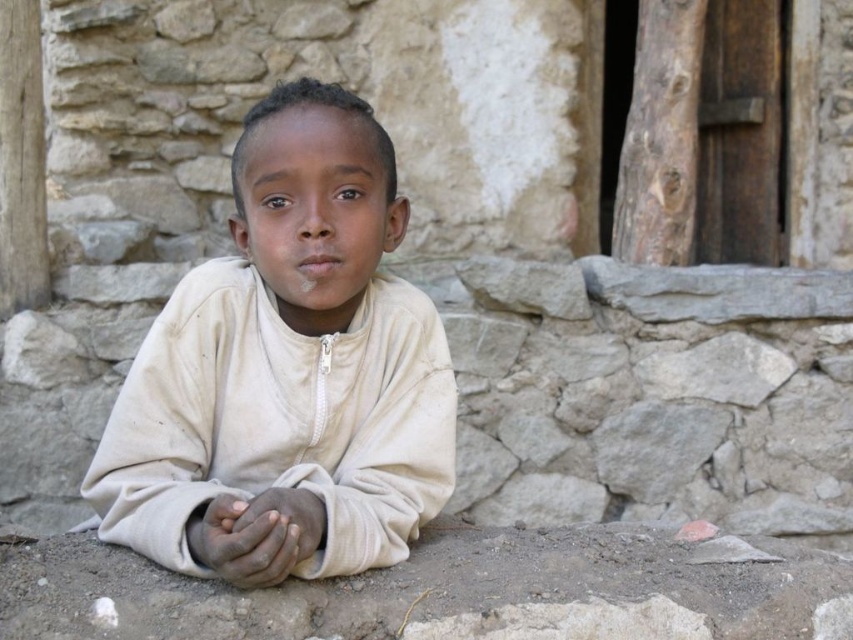
Can you confirm if white matte shirt at center is smaller than dark brown skin at center?

No, white matte shirt at center is not smaller than dark brown skin at center.

The width and height of the screenshot is (853, 640). In order to click on white matte shirt at center in this screenshot , I will do `click(287, 365)`.

Is dark brown skin at center positioned in front of smooth skin hands at center?

Yes.

Who is taller, dark brown skin at center or smooth skin hands at center?

With more height is dark brown skin at center.

The height and width of the screenshot is (640, 853). I want to click on dark brown skin at center, so click(x=245, y=540).

Where is `dark brown skin at center`? dark brown skin at center is located at coordinates (245, 540).

Between white matte shirt at center and smooth skin hands at center, which one appears on the left side from the viewer's perspective?

From the viewer's perspective, smooth skin hands at center appears more on the left side.

Between point (260, 445) and point (297, 499), which one is positioned behind?

Positioned behind is point (260, 445).

Identify the location of white matte shirt at center. Image resolution: width=853 pixels, height=640 pixels. (287, 365).